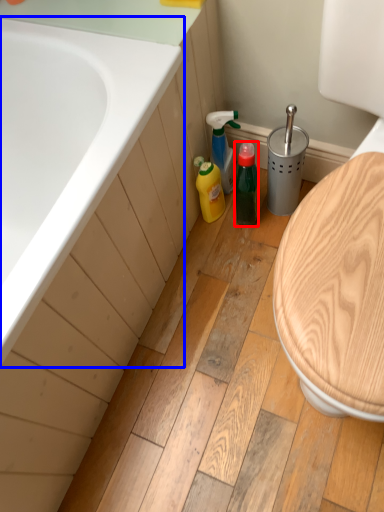
Question: Which object is further to the camera taking this photo, bottle (highlighted by a red box) or bathtub (highlighted by a blue box)?

Choices:
 (A) bottle
 (B) bathtub

Answer: (A)